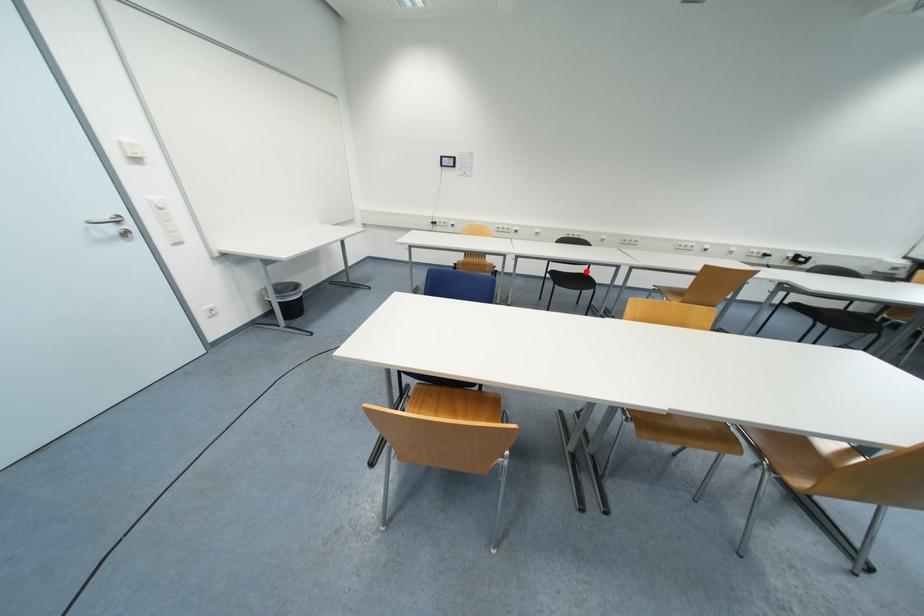
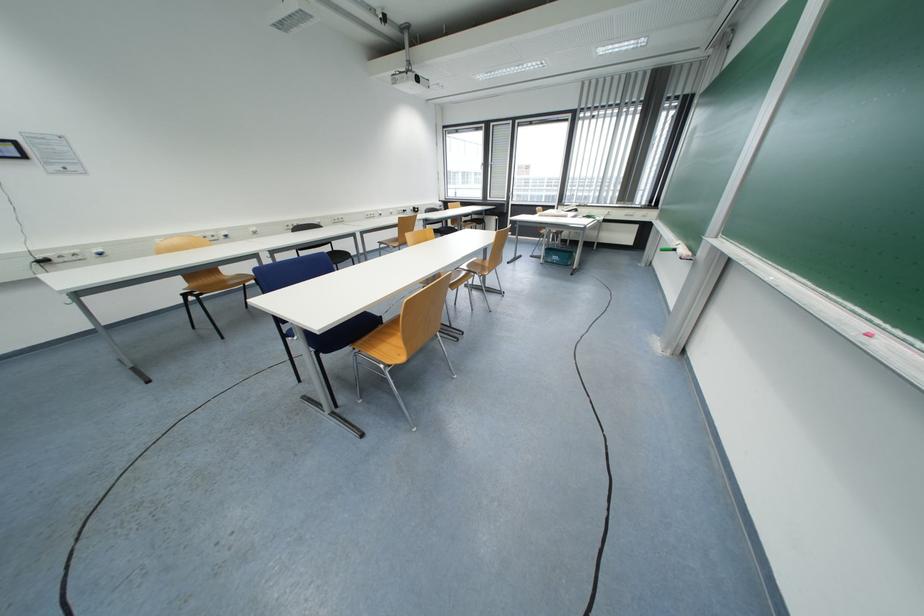
Locate, in the second image, the point that corresponds to the highlighted location in the first image.

(332, 251)